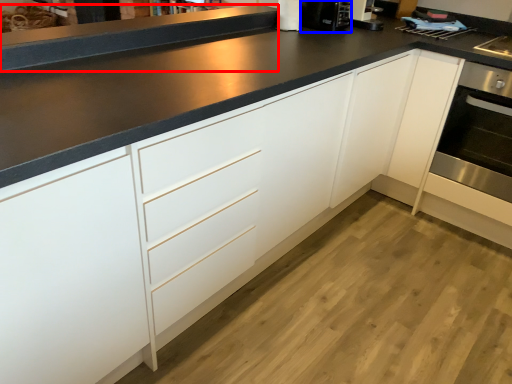
Question: Which object appears closest to the camera in this image, counter top (highlighted by a red box) or coffee machine (highlighted by a blue box)?

Choices:
 (A) counter top
 (B) coffee machine

Answer: (A)